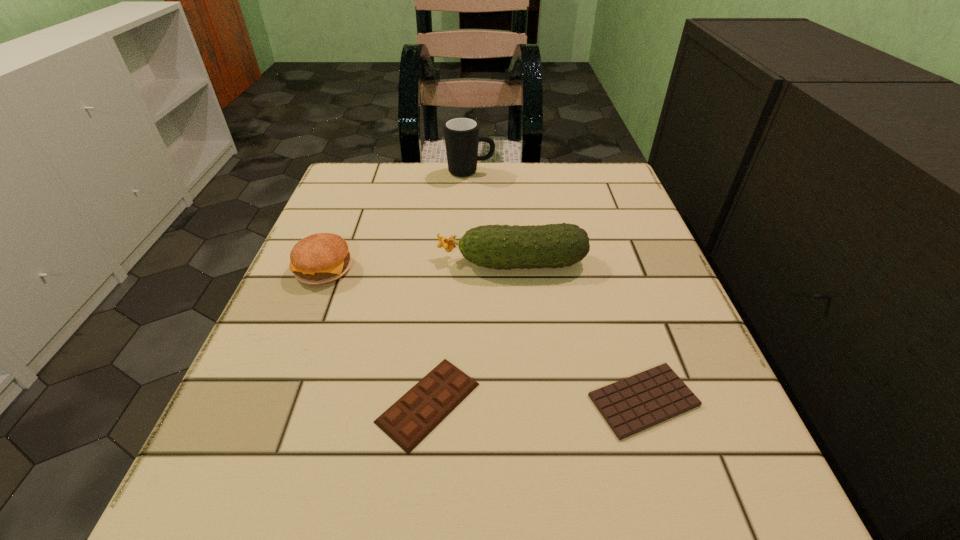
Where is `free space located 0.190m at the blossom end of the cucumber`? The image size is (960, 540). free space located 0.190m at the blossom end of the cucumber is located at coordinates (337, 262).

Locate an element on the screen. This screenshot has height=540, width=960. vacant area located 0.160m at the blossom end of the cucumber is located at coordinates (353, 262).

This screenshot has height=540, width=960. In order to click on free spot located at the blossom end of the cucumber in this screenshot , I will do [x=332, y=262].

The height and width of the screenshot is (540, 960). I want to click on free space located on the front of the third tallest object, so click(x=306, y=313).

The height and width of the screenshot is (540, 960). Find the location of `vacant area situated 0.340m on the back of the left chocolate bar`. vacant area situated 0.340m on the back of the left chocolate bar is located at coordinates (445, 227).

Locate an element on the screen. The height and width of the screenshot is (540, 960). free spot located on the back of the shortest object is located at coordinates (588, 220).

This screenshot has height=540, width=960. In order to click on object located at the far edge in this screenshot , I will do pyautogui.click(x=461, y=134).

Locate an element on the screen. object located at the left edge is located at coordinates (320, 258).

The width and height of the screenshot is (960, 540). I want to click on cucumber that is positioned at the right edge, so click(x=506, y=247).

Identify the location of chocolate bar that is at the right edge. (631, 405).